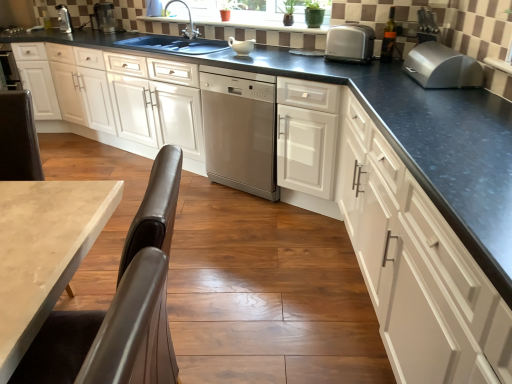
I want to click on vacant space underneath satin silver toaster at upper right, which is the first kitchen appliance from left to right (from a real-world perspective), so click(347, 64).